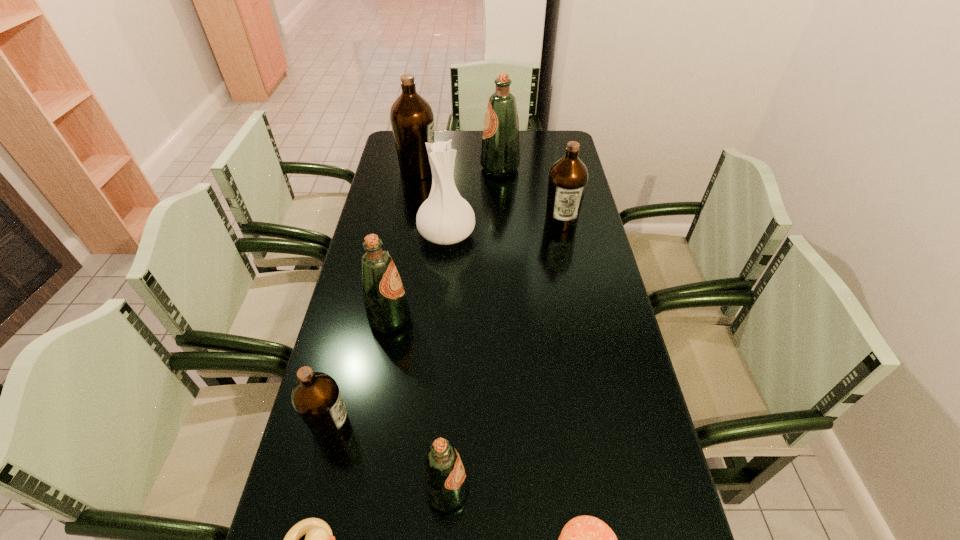
Where is `vacant space located 0.150m on the label of the fourth nearest object`? The image size is (960, 540). vacant space located 0.150m on the label of the fourth nearest object is located at coordinates (416, 425).

You are a GUI agent. You are given a task and a screenshot of the screen. Output one action in this format:
    pyautogui.click(x=<x>, y=<y>)
    Task: Click on the object that is positioned at the far edge
    This screenshot has width=960, height=540.
    Given the screenshot: What is the action you would take?
    pyautogui.click(x=500, y=153)

Find the location of a particular element. Image resolution: width=960 pixels, height=540 pixels. object located in the right edge section of the desktop is located at coordinates click(568, 177).

The height and width of the screenshot is (540, 960). I want to click on free region at the left edge, so click(x=379, y=219).

In the image, there is a desktop. Where is `vacant space at the right edge`? vacant space at the right edge is located at coordinates (566, 249).

Locate an element on the screen. This screenshot has width=960, height=540. empty space that is in between the third nearest olive oil and the smallest brown olive oil is located at coordinates (360, 372).

Identify the location of unoccupied area between the white vase and the rightmost olive oil. (504, 228).

Identify the location of free point between the rightmost green olive oil and the nearest brown olive oil. (416, 297).

Locate an element on the screen. Image resolution: width=960 pixels, height=540 pixels. free space between the third olive oil from right to left and the biggest brown olive oil is located at coordinates click(432, 330).

You are a GUI agent. You are given a task and a screenshot of the screen. Output one action in this format:
    pyautogui.click(x=<x>, y=<y>)
    Task: Click on the vacant area that lies between the biggest green olive oil and the rightmost olive oil
    This screenshot has width=960, height=540.
    Given the screenshot: What is the action you would take?
    pyautogui.click(x=531, y=195)